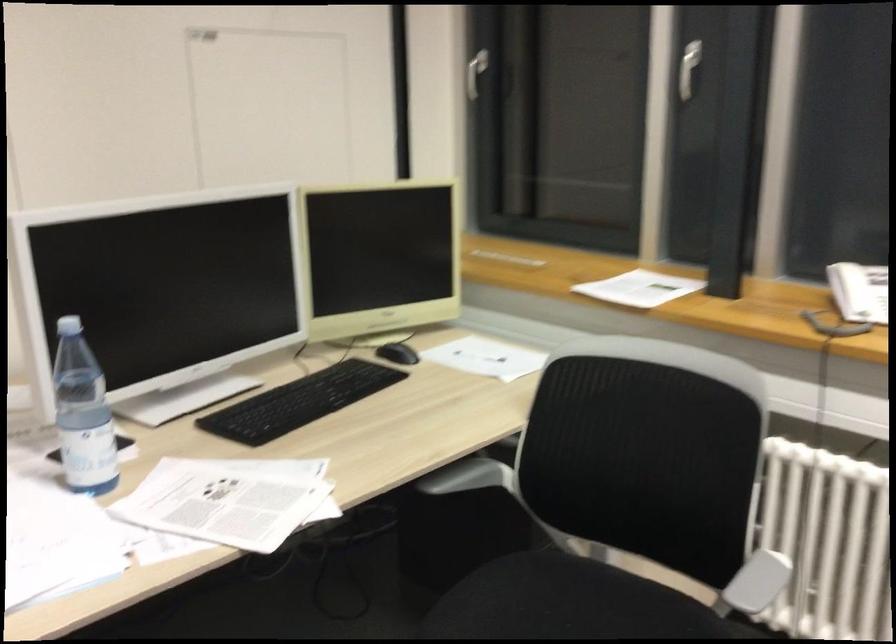
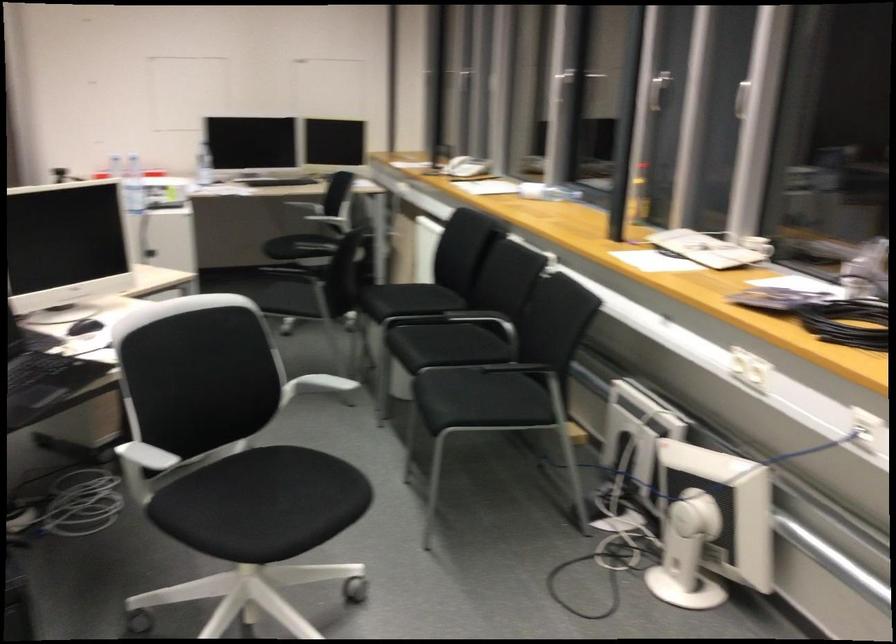
In the second image, find the point that corresponds to the point at 757,582 in the first image.

(323, 213)